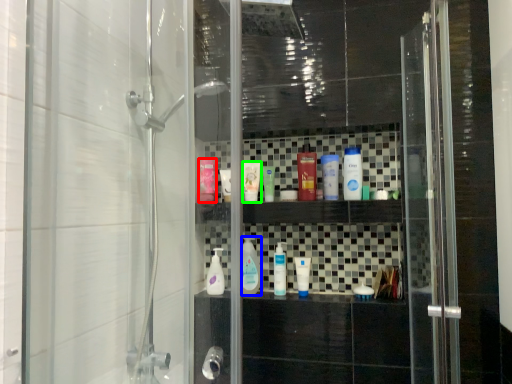
Question: Which object is positioned closest to mouthwash (highlighted by a red box)? Select from mouthwash (highlighted by a blue box) and toiletry (highlighted by a green box).

Choices:
 (A) mouthwash
 (B) toiletry

Answer: (B)